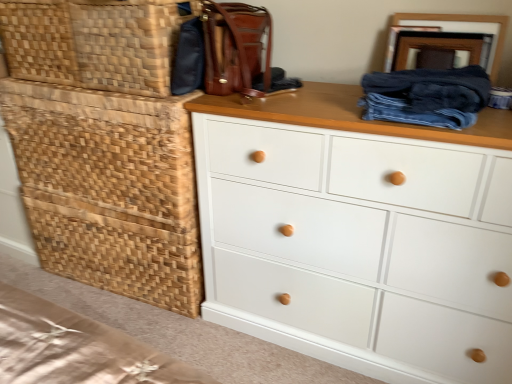
Question: Considering the positions of white painted wood chest of drawers at center and dark blue denim jeans at upper right in the image, is white painted wood chest of drawers at center wider or thinner than dark blue denim jeans at upper right?

Choices:
 (A) thin
 (B) wide

Answer: (B)

Question: In the image, is white painted wood chest of drawers at center positioned in front of or behind dark blue denim jeans at upper right?

Choices:
 (A) front
 (B) behind

Answer: (A)

Question: Which is nearer to the woven brown basket at upper left, arranged as the first basket when viewed from the top?

Choices:
 (A) woven wood basket at left
 (B) woven wood basket at left, which is the second basket in top-to-bottom order
 (C) white painted wood chest of drawers at center
 (D) leather handbag at upper center
 (E) dark blue denim jeans at upper right

Answer: (D)

Question: Based on their relative distances, which object is farther from the dark blue denim jeans at upper right?

Choices:
 (A) woven brown basket at upper left, the second basket positioned from the bottom
 (B) leather handbag at upper center
 (C) woven wood basket at left
 (D) woven wood basket at left, which is the second basket in top-to-bottom order
 (E) white painted wood chest of drawers at center

Answer: (D)